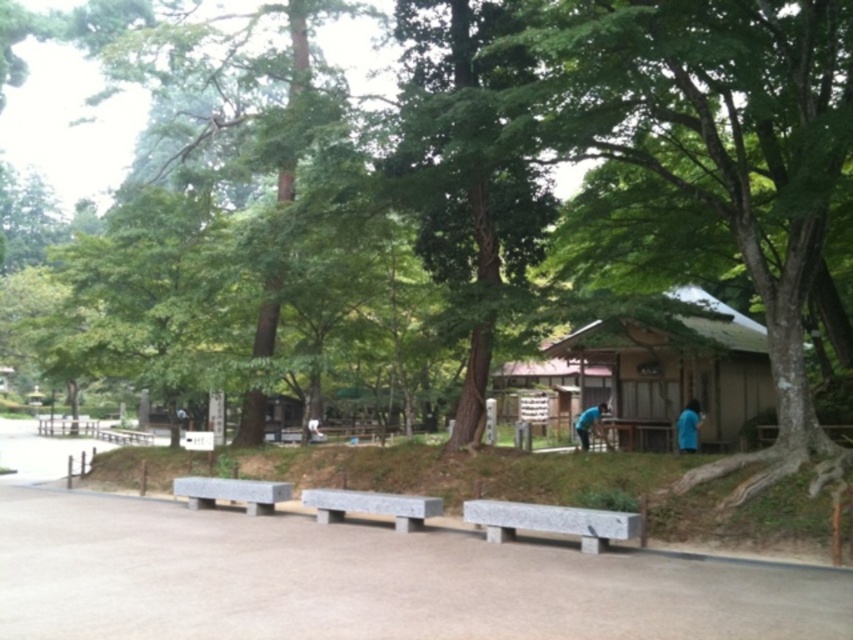
Does blue fabric shirt at lower right have a greater width compared to blue fabric shirt at center?

Correct, the width of blue fabric shirt at lower right exceeds that of blue fabric shirt at center.

From the picture: Can you confirm if blue fabric shirt at lower right is thinner than blue fabric shirt at center?

In fact, blue fabric shirt at lower right might be wider than blue fabric shirt at center.

Measure the distance between blue fabric shirt at lower right and camera.

blue fabric shirt at lower right and camera are 15.46 meters apart.

Where is `blue fabric shirt at lower right`? The height and width of the screenshot is (640, 853). blue fabric shirt at lower right is located at coordinates (688, 426).

Can you confirm if gray granite bench at center is positioned to the left of white fabric bag at center?

In fact, gray granite bench at center is to the right of white fabric bag at center.

Can you confirm if gray granite bench at center is wider than white fabric bag at center?

Correct, the width of gray granite bench at center exceeds that of white fabric bag at center.

Does point (491, 509) come in front of point (312, 432)?

Yes, it is in front of point (312, 432).

Where is `gray granite bench at center`? The width and height of the screenshot is (853, 640). gray granite bench at center is located at coordinates (552, 522).

What do you see at coordinates (466, 172) in the screenshot?
I see `green leafy tree at center` at bounding box center [466, 172].

Between point (445, 28) and point (578, 429), which one is positioned behind?

The point (578, 429) is behind.

Where is `green leafy tree at center`? green leafy tree at center is located at coordinates (466, 172).